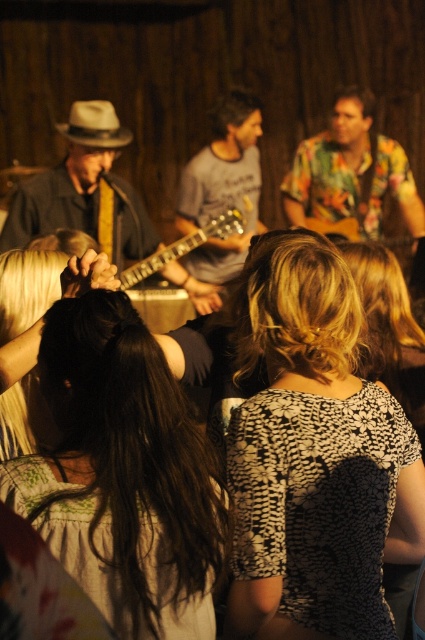
You are a photographer at the venue and want to capture a shot that includes both the white felt cowboy hat at upper left and the shiny metallic guitar at center. Which object should you position lower in your camera frame to ensure both are in the shot?

To include both the white felt cowboy hat at upper left and the shiny metallic guitar at center in the shot, you should position the white felt cowboy hat at upper left lower in your camera frame since it is located above the shiny metallic guitar at center.

You are standing at the entrance of the venue and want to take a photo of the black floral dress at center. Which direction should you face to capture it in your camera view?

To capture the black floral dress at center in your camera view, you should face towards the center of the venue since it is located at point (388, 326), which is near the central area.